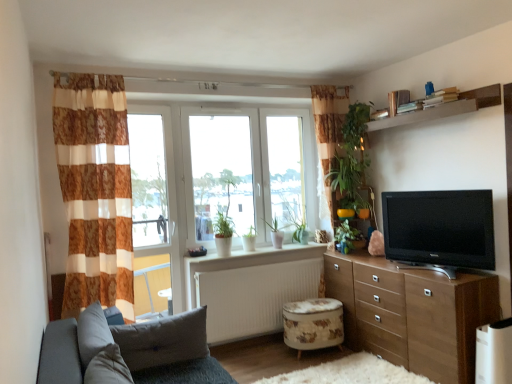
Image resolution: width=512 pixels, height=384 pixels. Find the location of `empty space that is ontop of floral fabric ottoman at lower center`. empty space that is ontop of floral fabric ottoman at lower center is located at coordinates (313, 304).